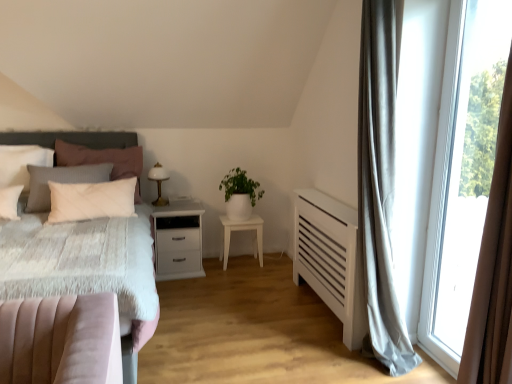
Image resolution: width=512 pixels, height=384 pixels. What do you see at coordinates (21, 163) in the screenshot?
I see `matte pink pillow at left, marked as the second pillow in a right-to-left arrangement` at bounding box center [21, 163].

Find the location of `white matte nightstand at center, which is the first nightstand from left to right`. white matte nightstand at center, which is the first nightstand from left to right is located at coordinates (178, 241).

Describe the element at coordinates (178, 241) in the screenshot. I see `white matte nightstand at center, which is the first nightstand from left to right` at that location.

What are the coordinates of `white matte pillow at left, acting as the 2th pillow starting from the left` in the screenshot? It's located at (104, 160).

Locate an element on the screen. The image size is (512, 384). velvet pink bed at left is located at coordinates (71, 139).

From a real-world perspective, is dark gray textured headboard at left located higher than matte pink pillow at left, positioned as the first pillow in left-to-right order?

Answer: No, from a real-world perspective, dark gray textured headboard at left is not above matte pink pillow at left, positioned as the first pillow in left-to-right order.

Considering the relative sizes of dark gray textured headboard at left and matte pink pillow at left, positioned as the first pillow in left-to-right order, in the image provided, is dark gray textured headboard at left bigger than matte pink pillow at left, positioned as the first pillow in left-to-right order,?

Yes, dark gray textured headboard at left is bigger than matte pink pillow at left, positioned as the first pillow in left-to-right order.

From their relative heights in the image, would you say dark gray textured headboard at left is taller or shorter than matte pink pillow at left, marked as the second pillow in a right-to-left arrangement?

Clearly, dark gray textured headboard at left is taller compared to matte pink pillow at left, marked as the second pillow in a right-to-left arrangement.

Between dark gray textured headboard at left and matte pink pillow at left, positioned as the first pillow in left-to-right order, which one is positioned in front?

dark gray textured headboard at left is in front.

Considering the sizes of objects white matte pillow at left, which ranks as the 1th pillow in right-to-left order, and white matte plant at center in the image provided, who is thinner, white matte pillow at left, which ranks as the 1th pillow in right-to-left order, or white matte plant at center?

white matte pillow at left, which ranks as the 1th pillow in right-to-left order, is thinner.

Is point (71, 149) behind point (234, 171)?

No.

Is white matte pillow at left, which ranks as the 1th pillow in right-to-left order, taller than white matte plant at center?

Indeed, white matte pillow at left, which ranks as the 1th pillow in right-to-left order, has a greater height compared to white matte plant at center.

Considering the relative positions of white matte pillow at left, acting as the 2th pillow starting from the left, and white matte plant at center in the image provided, is white matte pillow at left, acting as the 2th pillow starting from the left, in front of white matte plant at center?

Yes, white matte pillow at left, acting as the 2th pillow starting from the left, is closer to the viewer.

Is white matte nightstand at center, which is the first nightstand from left to right, inside or outside of matte pink pillow at left, marked as the second pillow in a right-to-left arrangement?

white matte nightstand at center, which is the first nightstand from left to right, is spatially situated outside matte pink pillow at left, marked as the second pillow in a right-to-left arrangement.

In the scene shown: Based on their sizes in the image, would you say white matte nightstand at center, which is counted as the 2th nightstand, starting from the right, is bigger or smaller than matte pink pillow at left, positioned as the first pillow in left-to-right order?

In the image, white matte nightstand at center, which is counted as the 2th nightstand, starting from the right, appears to be larger than matte pink pillow at left, positioned as the first pillow in left-to-right order.

Would you consider white matte nightstand at center, which is the first nightstand from left to right, to be distant from matte pink pillow at left, marked as the second pillow in a right-to-left arrangement?

Yes.

Can you confirm if dark gray textured headboard at left is wider than white glossy table lamp at center?

Correct, the width of dark gray textured headboard at left exceeds that of white glossy table lamp at center.

Between dark gray textured headboard at left and white glossy table lamp at center, which one is positioned behind?

Positioned behind is white glossy table lamp at center.

Considering the sizes of dark gray textured headboard at left and white glossy table lamp at center in the image, is dark gray textured headboard at left bigger or smaller than white glossy table lamp at center?

Considering their sizes, dark gray textured headboard at left takes up more space than white glossy table lamp at center.

Which object is closer to the camera, dark gray textured headboard at left or white matte nightstand at center, which is counted as the 2th nightstand, starting from the right?

dark gray textured headboard at left is in front.

From a real-world perspective, is dark gray textured headboard at left above or below white matte nightstand at center, which is counted as the 2th nightstand, starting from the right?

Clearly, from a real-world perspective, dark gray textured headboard at left is above white matte nightstand at center, which is counted as the 2th nightstand, starting from the right.

Considering the sizes of dark gray textured headboard at left and white matte nightstand at center, which is counted as the 2th nightstand, starting from the right, in the image, is dark gray textured headboard at left bigger or smaller than white matte nightstand at center, which is counted as the 2th nightstand, starting from the right,?

dark gray textured headboard at left is bigger than white matte nightstand at center, which is counted as the 2th nightstand, starting from the right.

Which object is further away from the camera taking this photo, white matte plant at center or velvet pink bed at left?

white matte plant at center is further from the camera.

From the image's perspective, which is below, white matte plant at center or velvet pink bed at left?

velvet pink bed at left is shown below in the image.

Considering the sizes of white matte plant at center and velvet pink bed at left in the image, is white matte plant at center wider or thinner than velvet pink bed at left?

white matte plant at center is thinner than velvet pink bed at left.

Considering the relative sizes of velvet pink bed at left and white matte nightstand at center, the 2th nightstand from the left, in the image provided, is velvet pink bed at left thinner than white matte nightstand at center, the 2th nightstand from the left,?

In fact, velvet pink bed at left might be wider than white matte nightstand at center, the 2th nightstand from the left.

Considering the positions of points (88, 142) and (229, 235), is point (88, 142) closer to camera compared to point (229, 235)?

Yes, it is.

From the image's perspective, is velvet pink bed at left located beneath white matte nightstand at center, the 1th nightstand in the right-to-left sequence?

No, from the image's perspective, velvet pink bed at left is not below white matte nightstand at center, the 1th nightstand in the right-to-left sequence.

Could you tell me if velvet pink bed at left is turned towards white matte nightstand at center, the 2th nightstand from the left?

No, velvet pink bed at left is not turned towards white matte nightstand at center, the 2th nightstand from the left.

This screenshot has width=512, height=384. I want to click on pillow that appears on the left of dark gray textured headboard at left, so click(x=21, y=163).

You are a GUI agent. You are given a task and a screenshot of the screen. Output one action in this format:
    pyautogui.click(x=<x>, y=<y>)
    Task: Click on the 2nd pillow in front of the white matte plant at center, counting from the anchor's position
    The height and width of the screenshot is (384, 512).
    Given the screenshot: What is the action you would take?
    pyautogui.click(x=104, y=160)

Based on their spatial positions, is white glossy table lamp at center or dark gray textured headboard at left further from white matte pillow at left, which ranks as the 1th pillow in right-to-left order?

white glossy table lamp at center lies further to white matte pillow at left, which ranks as the 1th pillow in right-to-left order, than the other object.

From the image, which object appears to be nearer to white matte pillow at left, acting as the 2th pillow starting from the left, matte pink pillow at left, positioned as the first pillow in left-to-right order, or velvet pink bed at left?

Based on the image, velvet pink bed at left appears to be nearer to white matte pillow at left, acting as the 2th pillow starting from the left.

When comparing their distances from white matte pillow at left, which ranks as the 1th pillow in right-to-left order, does white matte nightstand at center, which is counted as the 2th nightstand, starting from the right, or dark gray textured headboard at left seem further?

Based on the image, white matte nightstand at center, which is counted as the 2th nightstand, starting from the right, appears to be further to white matte pillow at left, which ranks as the 1th pillow in right-to-left order.

Estimate the real-world distances between objects in this image. Which object is further from white glossy table lamp at center, dark gray textured headboard at left or white matte pillow at left, acting as the 2th pillow starting from the left?

Based on the image, dark gray textured headboard at left appears to be further to white glossy table lamp at center.

Which object lies further to the anchor point white matte plant at center, matte pink pillow at left, positioned as the first pillow in left-to-right order, or dark gray textured headboard at left?

matte pink pillow at left, positioned as the first pillow in left-to-right order, is further to white matte plant at center.

When comparing their distances from matte pink pillow at left, positioned as the first pillow in left-to-right order, does white matte plant at center or white glossy table lamp at center seem closer?

The object closer to matte pink pillow at left, positioned as the first pillow in left-to-right order, is white glossy table lamp at center.

When comparing their distances from white glossy table lamp at center, does matte pink pillow at left, positioned as the first pillow in left-to-right order, or white matte nightstand at center, which is counted as the 2th nightstand, starting from the right, seem closer?

white matte nightstand at center, which is counted as the 2th nightstand, starting from the right.

From the image, which object appears to be nearer to white matte nightstand at center, which is the first nightstand from left to right, white glossy table lamp at center or velvet pink bed at left?

white glossy table lamp at center lies closer to white matte nightstand at center, which is the first nightstand from left to right, than the other object.

Locate an element on the screen. This screenshot has height=384, width=512. headboard between velvet pink bed at left and white matte nightstand at center, the 1th nightstand in the right-to-left sequence, along the z-axis is located at coordinates (71, 139).

Identify the location of nightstand between white glossy table lamp at center and white matte nightstand at center, the 2th nightstand from the left, in the horizontal direction. The image size is (512, 384). (178, 241).

At what (x,y) coordinates should I click in order to perform the action: click on nightstand between white matte pillow at left, which ranks as the 1th pillow in right-to-left order, and white matte plant at center. Please return your answer as a coordinate pair (x, y). Looking at the image, I should click on (178, 241).

I want to click on headboard located between velvet pink bed at left and white matte plant at center in the depth direction, so click(71, 139).